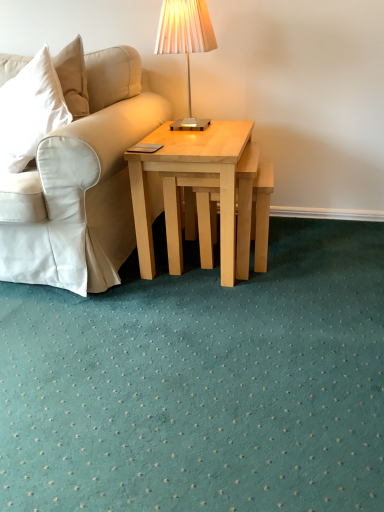
Where is `free space in front of metallic silver table lamp at upper center`? free space in front of metallic silver table lamp at upper center is located at coordinates (200, 138).